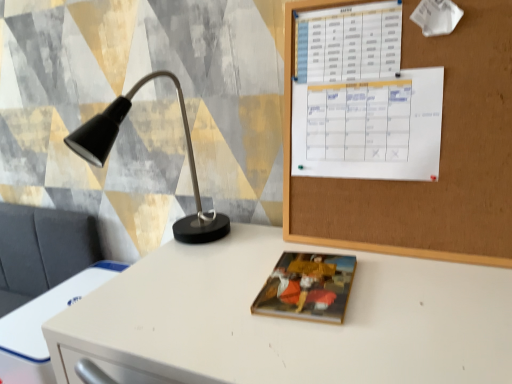
Question: Is white plastic drawer at lower left bigger than matte paper book at center?

Choices:
 (A) no
 (B) yes

Answer: (B)

Question: Can you confirm if white plastic drawer at lower left is wider than matte paper book at center?

Choices:
 (A) yes
 (B) no

Answer: (A)

Question: From a real-world perspective, is white plastic drawer at lower left under matte paper book at center?

Choices:
 (A) yes
 (B) no

Answer: (A)

Question: Is white plastic drawer at lower left surrounding matte paper book at center?

Choices:
 (A) yes
 (B) no

Answer: (B)

Question: Considering the relative sizes of white plastic drawer at lower left and matte paper book at center in the image provided, is white plastic drawer at lower left thinner than matte paper book at center?

Choices:
 (A) no
 (B) yes

Answer: (A)

Question: Choose the correct answer: Is white paper calendar at upper right inside white plastic drawer at lower left or outside it?

Choices:
 (A) outside
 (B) inside

Answer: (A)

Question: Is point (436, 94) closer or farther from the camera than point (59, 289)?

Choices:
 (A) closer
 (B) farther

Answer: (A)

Question: Is white paper calendar at upper right to the left or to the right of white plastic drawer at lower left in the image?

Choices:
 (A) right
 (B) left

Answer: (A)

Question: Is white paper calendar at upper right taller or shorter than white plastic drawer at lower left?

Choices:
 (A) tall
 (B) short

Answer: (A)

Question: Considering their positions, is matte black lamp at left located in front of or behind matte paper book at center?

Choices:
 (A) behind
 (B) front

Answer: (A)

Question: Is point (86, 155) closer or farther from the camera than point (330, 279)?

Choices:
 (A) farther
 (B) closer

Answer: (A)

Question: From a real-world perspective, is matte black lamp at left positioned above or below matte paper book at center?

Choices:
 (A) below
 (B) above

Answer: (B)

Question: From their relative heights in the image, would you say matte black lamp at left is taller or shorter than matte paper book at center?

Choices:
 (A) short
 (B) tall

Answer: (B)

Question: Would you say matte paper book at center is to the left or to the right of white paper calendar at upper right in the picture?

Choices:
 (A) left
 (B) right

Answer: (A)

Question: Considering the positions of matte paper book at center and white paper calendar at upper right in the image, is matte paper book at center taller or shorter than white paper calendar at upper right?

Choices:
 (A) tall
 (B) short

Answer: (B)